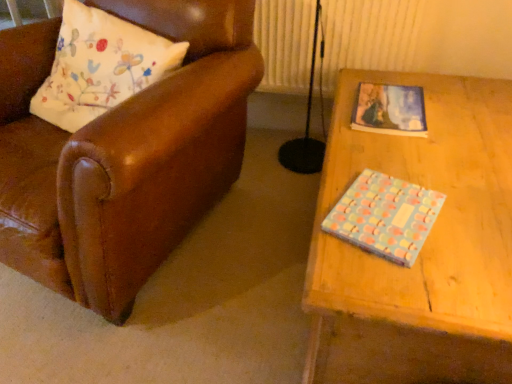
Question: Is pastel-patterned paper at upper right, which is the second book from bottom to top, located within pastel polka dot book at right, the first book positioned from the bottom?

Choices:
 (A) yes
 (B) no

Answer: (B)

Question: Is pastel polka dot book at right, positioned as the first book in front-to-back order, looking in the opposite direction of pastel-patterned paper at upper right, the 2th book in the front-to-back sequence?

Choices:
 (A) yes
 (B) no

Answer: (B)

Question: From the image's perspective, is pastel polka dot book at right, positioned as the first book in front-to-back order, located above pastel-patterned paper at upper right, the 2th book in the front-to-back sequence?

Choices:
 (A) yes
 (B) no

Answer: (B)

Question: From a real-world perspective, does pastel polka dot book at right, positioned as the first book in front-to-back order, stand above pastel-patterned paper at upper right, the 2th book in the front-to-back sequence?

Choices:
 (A) no
 (B) yes

Answer: (B)

Question: Is pastel polka dot book at right, the first book positioned from the bottom, next to pastel-patterned paper at upper right, which is counted as the 1th book, starting from the top?

Choices:
 (A) no
 (B) yes

Answer: (A)

Question: Is pastel polka dot book at right, the first book positioned from the bottom, taller than pastel-patterned paper at upper right, arranged as the 1th book when viewed from the back?

Choices:
 (A) no
 (B) yes

Answer: (B)

Question: Is leather pillow at left bigger than pastel-patterned paper at upper right, the 2th book in the front-to-back sequence?

Choices:
 (A) yes
 (B) no

Answer: (A)

Question: Does leather pillow at left lie in front of pastel-patterned paper at upper right, which is the second book from bottom to top?

Choices:
 (A) yes
 (B) no

Answer: (A)

Question: Considering the relative positions of leather pillow at left and pastel-patterned paper at upper right, which is the second book from bottom to top, in the image provided, is leather pillow at left to the right of pastel-patterned paper at upper right, which is the second book from bottom to top, from the viewer's perspective?

Choices:
 (A) yes
 (B) no

Answer: (B)

Question: Is leather pillow at left wider than pastel-patterned paper at upper right, the 2th book in the front-to-back sequence?

Choices:
 (A) yes
 (B) no

Answer: (A)

Question: Considering the relative sizes of leather pillow at left and pastel-patterned paper at upper right, the 2th book in the front-to-back sequence, in the image provided, is leather pillow at left taller than pastel-patterned paper at upper right, the 2th book in the front-to-back sequence,?

Choices:
 (A) yes
 (B) no

Answer: (A)

Question: Is leather pillow at left aimed at pastel-patterned paper at upper right, arranged as the 1th book when viewed from the back?

Choices:
 (A) no
 (B) yes

Answer: (A)

Question: Does pastel-patterned paper at upper right, arranged as the 1th book when viewed from the back, have a greater width compared to pastel polka dot book at right, the first book positioned from the bottom?

Choices:
 (A) no
 (B) yes

Answer: (B)